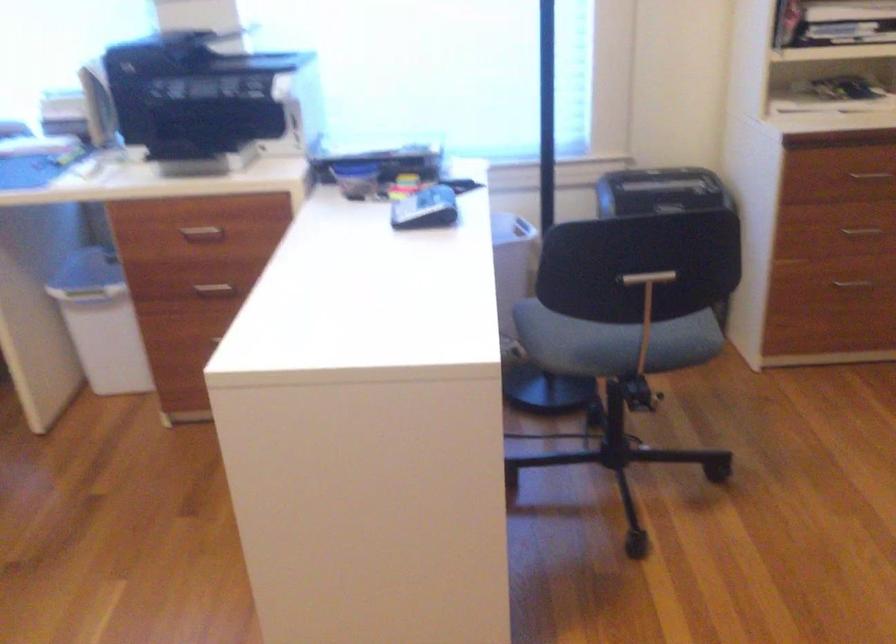
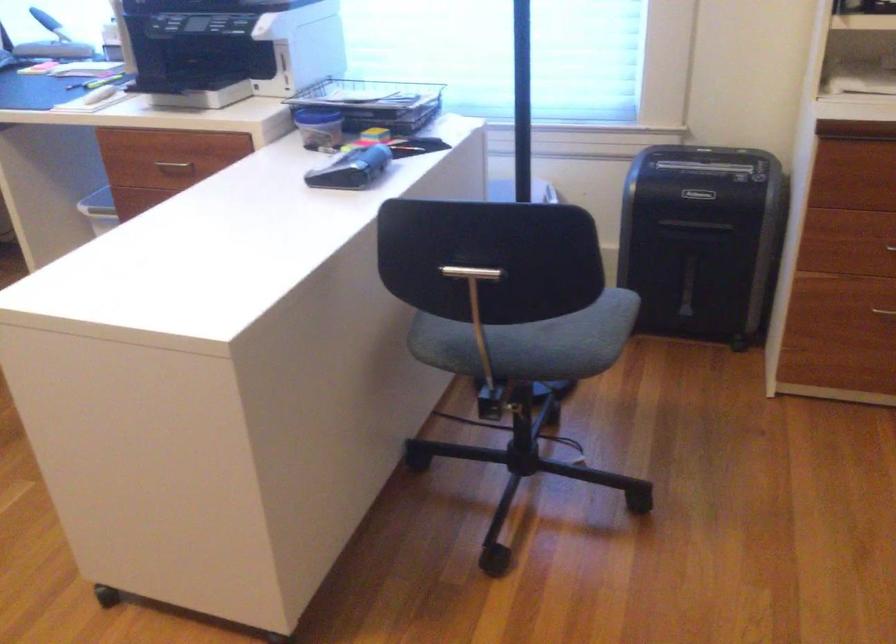
Find the pixel in the second image that matches [400,153] in the first image.

(374, 102)